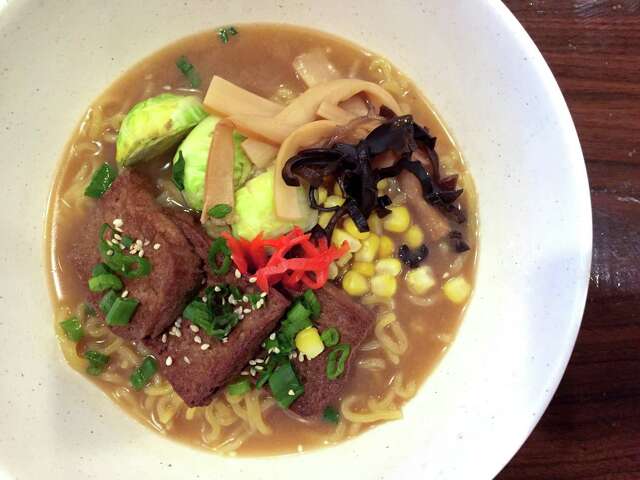
This screenshot has height=480, width=640. What are the coordinates of `wooden table` in the screenshot? It's located at (616, 88).